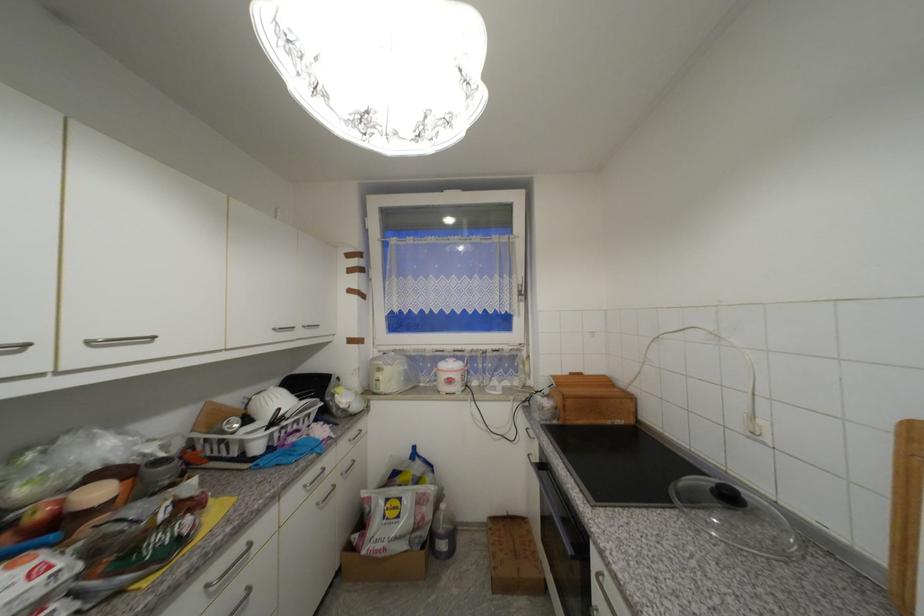
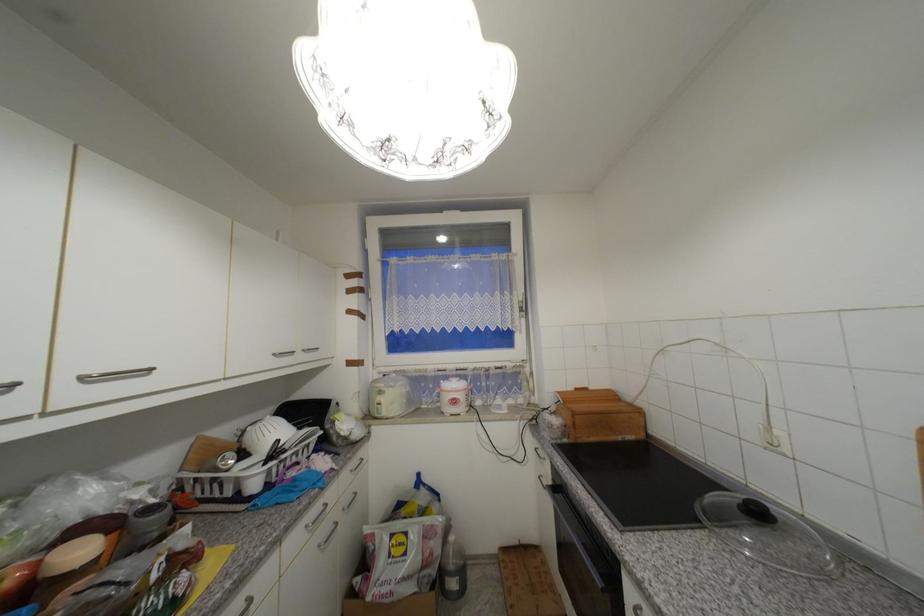
Find the pixel in the second image that matches point (281, 331) in the first image.

(281, 355)